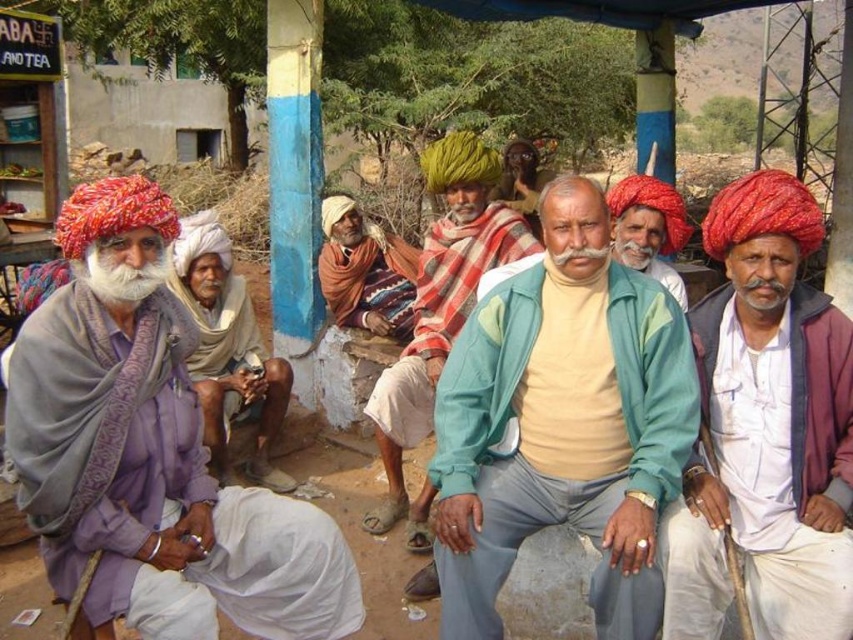
How distant is white cotton turban at center from whitesoftbeard at left?

They are 6.59 feet apart.

Image resolution: width=853 pixels, height=640 pixels. What are the coordinates of `white cotton turban at center` in the screenshot? It's located at (228, 349).

Where is `white cotton turban at center`? The image size is (853, 640). white cotton turban at center is located at coordinates (228, 349).

Can you confirm if matte purple shawl at left is positioned to the left of green felt turban at center?

Yes, matte purple shawl at left is to the left of green felt turban at center.

Does matte purple shawl at left appear over green felt turban at center?

No.

The width and height of the screenshot is (853, 640). What do you see at coordinates (152, 460) in the screenshot?
I see `matte purple shawl at left` at bounding box center [152, 460].

The width and height of the screenshot is (853, 640). I want to click on matte purple shawl at left, so click(x=152, y=460).

Is matte purple shawl at left shorter than matte red turban at center?

No.

Does point (132, 584) come behind point (682, 243)?

No, it is not.

The image size is (853, 640). Describe the element at coordinates (152, 460) in the screenshot. I see `matte purple shawl at left` at that location.

The image size is (853, 640). In order to click on matte purple shawl at left in this screenshot , I will do [152, 460].